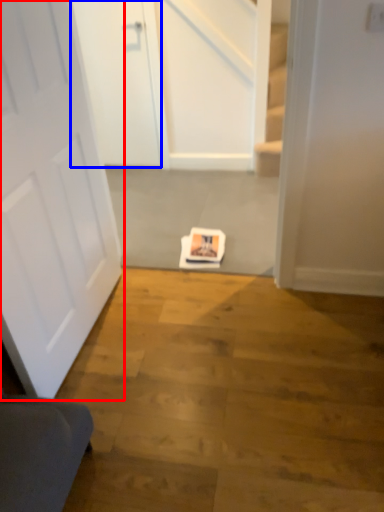
Question: Which object is closer to the camera taking this photo, door (highlighted by a red box) or door (highlighted by a blue box)?

Choices:
 (A) door
 (B) door

Answer: (A)